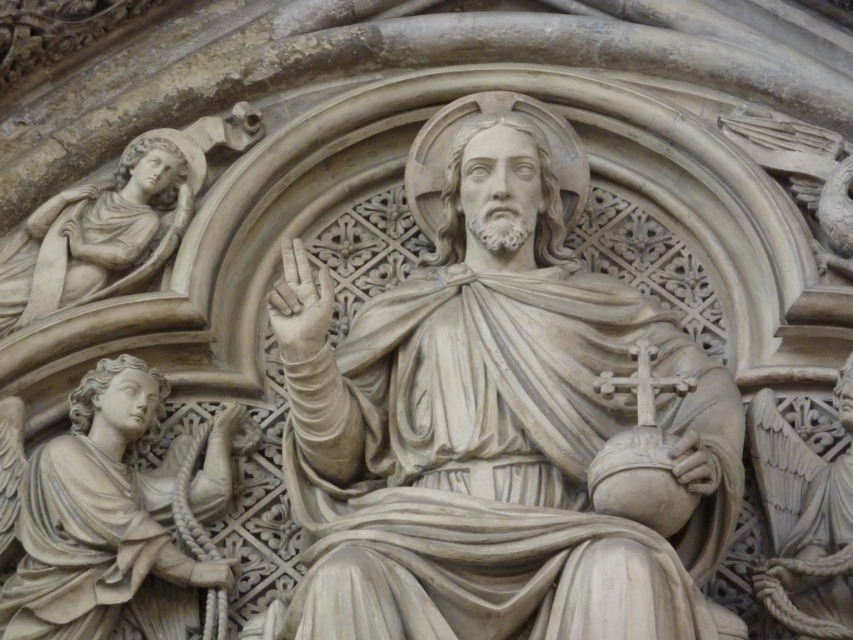
Question: Is matte stone angel at lower left closer to camera compared to white stone angel at right?

Choices:
 (A) no
 (B) yes

Answer: (A)

Question: Which of the following is the closest to the observer?

Choices:
 (A) white marble angel at upper left
 (B) white stone angel at right
 (C) white marble statue at center

Answer: (C)

Question: Which is nearer to the white stone angel at right?

Choices:
 (A) white marble angel at upper left
 (B) white marble statue at center
 (C) matte stone angel at lower left

Answer: (B)

Question: Is white marble statue at center thinner than white stone angel at right?

Choices:
 (A) yes
 (B) no

Answer: (B)

Question: Does matte stone angel at lower left appear over white stone angel at right?

Choices:
 (A) yes
 (B) no

Answer: (B)

Question: Which object is farther from the camera taking this photo?

Choices:
 (A) white marble statue at center
 (B) matte stone angel at lower left
 (C) white stone angel at right
 (D) white marble angel at upper left

Answer: (D)